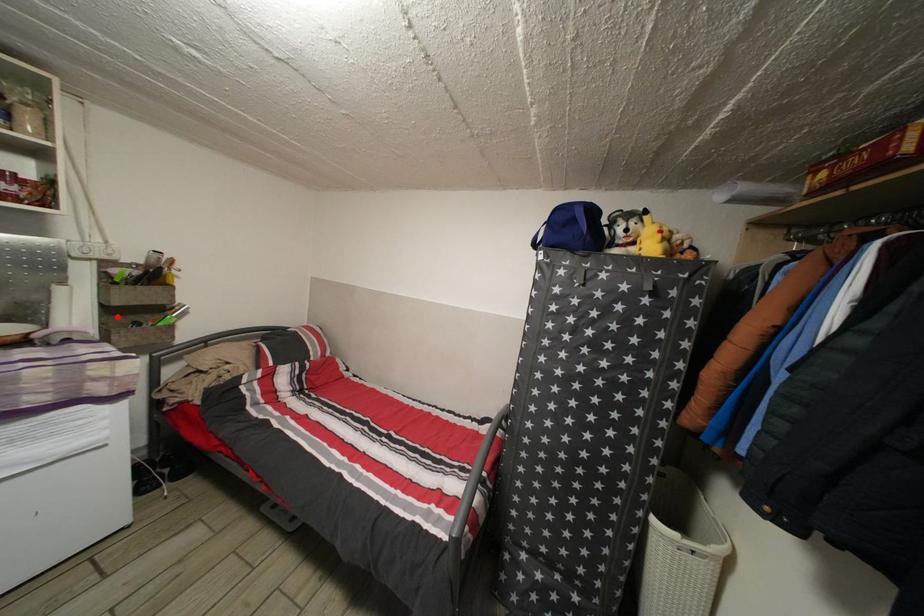
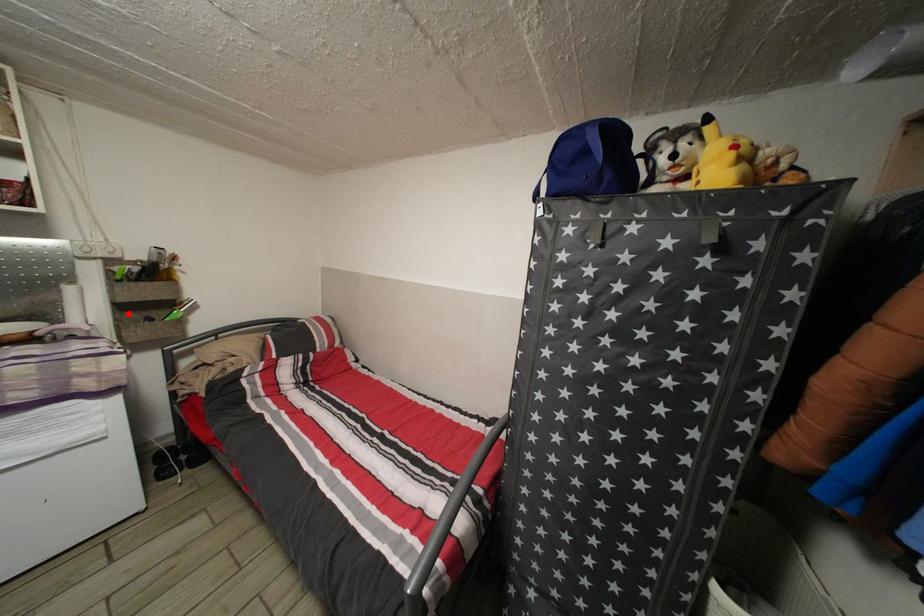
I am providing you with two images of the same scene from different viewpoints. A red point is marked on the first image and another point is marked on the second image. Do the highlighted points in image1 and image2 indicate the same real-world spot?

Yes